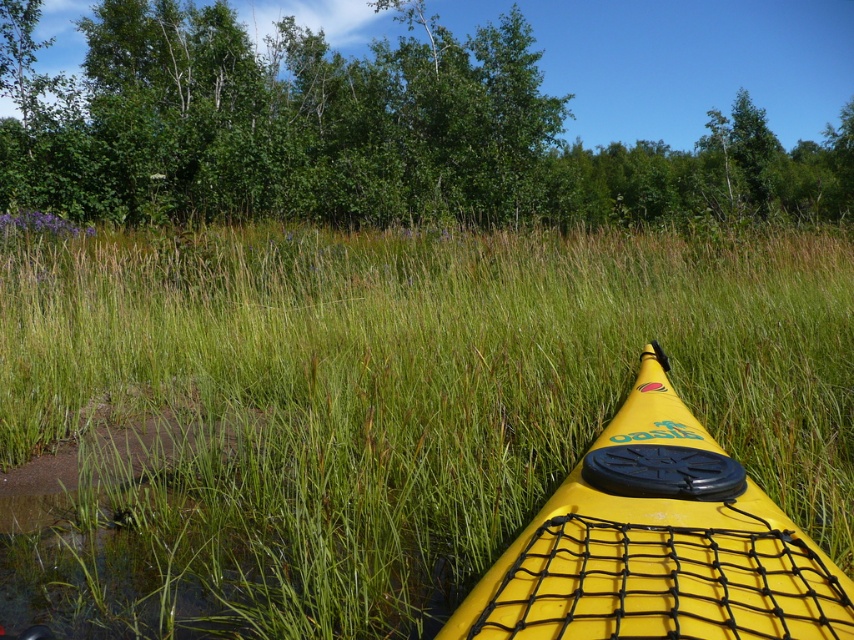
Question: From the image, what is the correct spatial relationship of green leafy tree at upper center in relation to yellow matte kayak at center?

Choices:
 (A) below
 (B) above

Answer: (B)

Question: Does green leafy tree at upper center lie in front of yellow matte kayak at center?

Choices:
 (A) no
 (B) yes

Answer: (A)

Question: Which object is farther from the camera taking this photo?

Choices:
 (A) yellow matte kayak at center
 (B) green leafy tree at upper center

Answer: (B)

Question: Does green grassy at center lie in front of green leafy tree at upper center?

Choices:
 (A) yes
 (B) no

Answer: (A)

Question: Which point is farther to the camera?

Choices:
 (A) (180, 17)
 (B) (92, 563)

Answer: (A)

Question: Among these objects, which one is nearest to the camera?

Choices:
 (A) yellow matte kayak at center
 (B) green leafy tree at upper center

Answer: (A)